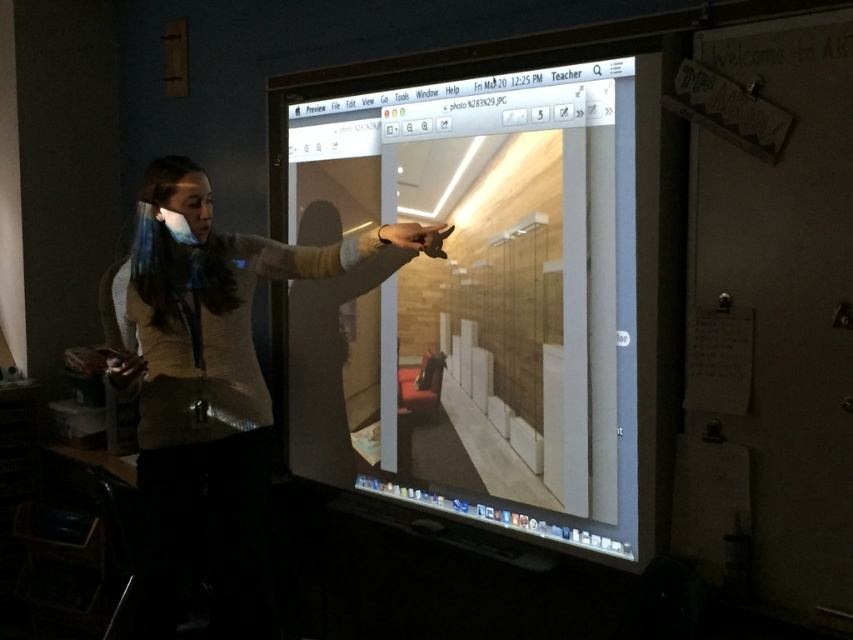
Is matte wooden screen at center positioned before matte beige sweater at center?

That is True.

Between matte wooden screen at center and matte beige sweater at center, which one is positioned lower?

matte beige sweater at center

You are a GUI agent. You are given a task and a screenshot of the screen. Output one action in this format:
    pyautogui.click(x=<x>, y=<y>)
    Task: Click on the matte wooden screen at center
    This screenshot has height=640, width=853.
    Given the screenshot: What is the action you would take?
    pyautogui.click(x=474, y=300)